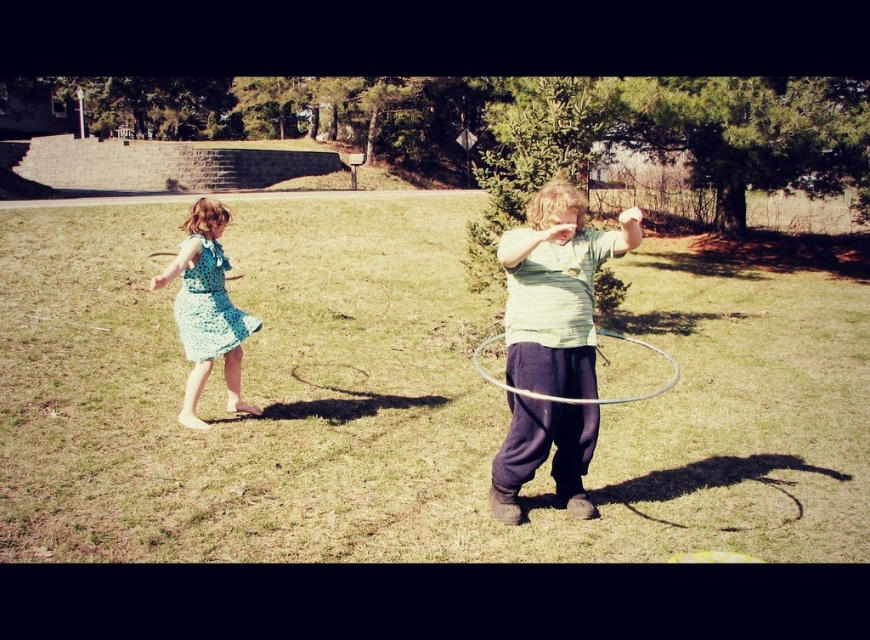
Question: Is clear plastic hula hoop at center further to camera compared to silver metallic hula hoop at center?

Choices:
 (A) yes
 (B) no

Answer: (B)

Question: Does clear plastic hula hoop at center lie behind silver metallic hula hoop at center?

Choices:
 (A) no
 (B) yes

Answer: (A)

Question: Which object is farther from the camera taking this photo?

Choices:
 (A) light green fabric shirt at center
 (B) silver metallic hula hoop at center

Answer: (B)

Question: Considering the relative positions of green dotted dress at left and silver metallic hula hoop at center in the image provided, where is green dotted dress at left located with respect to silver metallic hula hoop at center?

Choices:
 (A) above
 (B) below

Answer: (A)

Question: Which object is positioned farthest from the clear plastic hula hoop at center?

Choices:
 (A) green dotted dress at left
 (B) silver metallic hula hoop at center

Answer: (A)

Question: Which of the following is the closest to the observer?

Choices:
 (A) light green fabric shirt at center
 (B) green dotted dress at left
 (C) silver metallic hula hoop at center

Answer: (A)